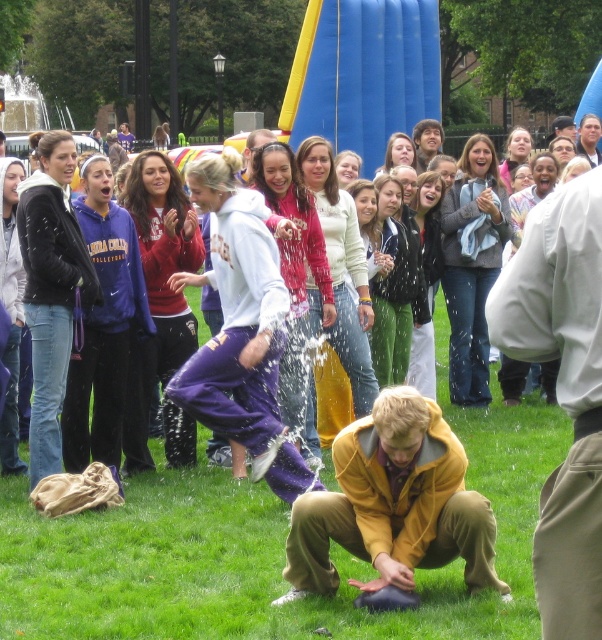
You are standing in the grassy field and want to throw a small ball to the light brown cotton pants at lower right and the smooth white shirt at upper right. Which one can you reach first if you throw the ball straight ahead?

The light brown cotton pants at lower right is closer to the viewer than the smooth white shirt at upper right, so you can reach the light brown cotton pants at lower right first.

You are a photographer trying to capture a candid shot of the green grass at lower center and the smooth white shirt at upper right. Since you want both subjects to be clearly visible in the frame, which object should you focus on to ensure proper depth of field?

The green grass at lower center is wider than the smooth white shirt at upper right, so focusing on the green grass at lower center will ensure both subjects are in focus due to its larger size.

You are a photographer trying to capture the light brown cotton pants at lower right and the smooth white shirt at upper right in the same frame. Which item will appear smaller in your photo?

The light brown cotton pants at lower right will appear smaller in the photo because it has a smaller size compared to the smooth white shirt at upper right.